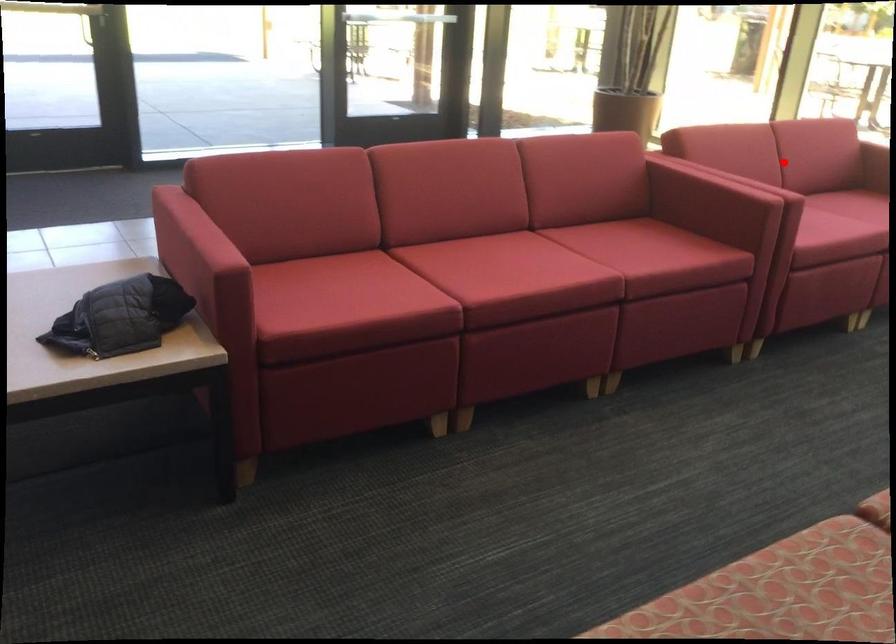
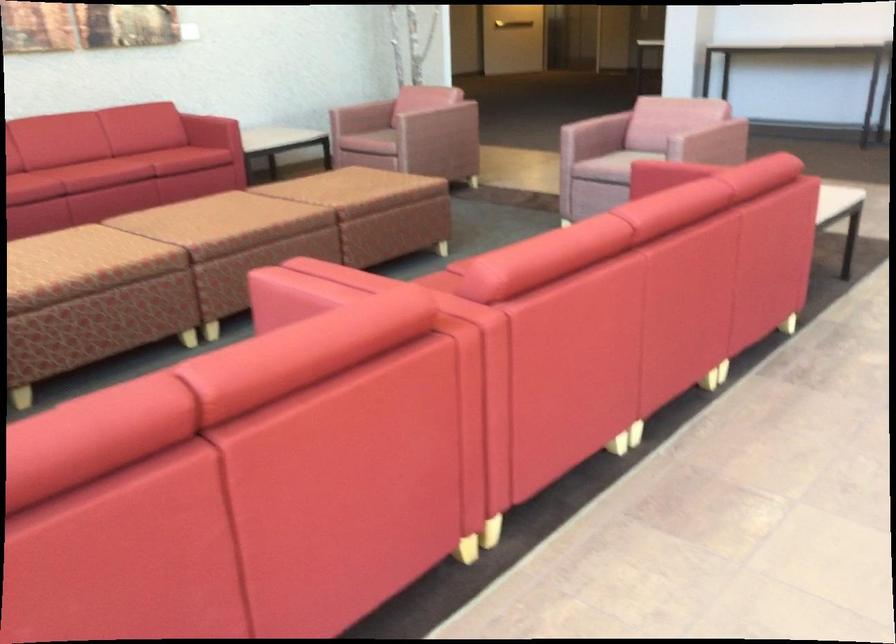
Where in the second image is the point corresponding to the highlighted location from the first image?

(112, 574)